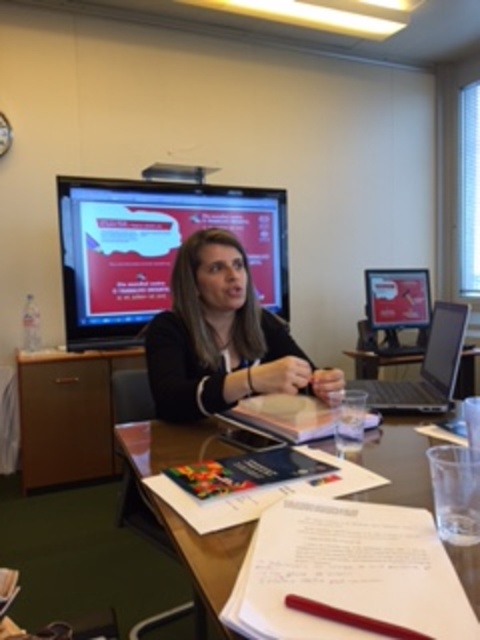
Is white paper at center below satin silver laptop at right?

Correct, white paper at center is located below satin silver laptop at right.

Is white paper at center above satin silver laptop at right?

Incorrect, white paper at center is not positioned above satin silver laptop at right.

This screenshot has height=640, width=480. What are the coordinates of `white paper at center` in the screenshot? It's located at click(179, 515).

Measure the distance between matte black jacket at center and satin silver laptop at right.

A distance of 32.70 centimeters exists between matte black jacket at center and satin silver laptop at right.

Who is positioned more to the right, matte black jacket at center or satin silver laptop at right?

satin silver laptop at right is more to the right.

This screenshot has width=480, height=640. I want to click on matte black jacket at center, so click(x=222, y=337).

Does point (259, 326) lie in front of point (164, 444)?

That is False.

You are a GUI agent. You are given a task and a screenshot of the screen. Output one action in this format:
    pyautogui.click(x=<x>, y=<y>)
    Task: Click on the matte black jacket at center
    
    Given the screenshot: What is the action you would take?
    pyautogui.click(x=222, y=337)

Measure the distance between point (226, 312) and camera.

Point (226, 312) and camera are 1.79 meters apart from each other.

The image size is (480, 640). Identify the location of matte black jacket at center. (222, 337).